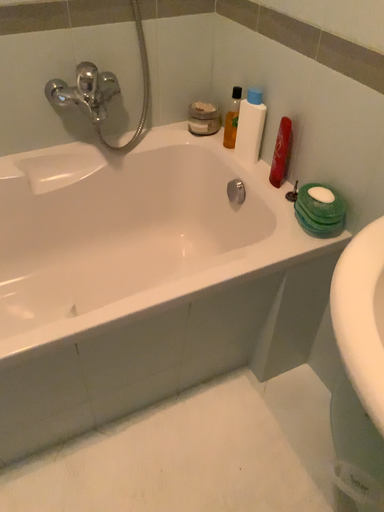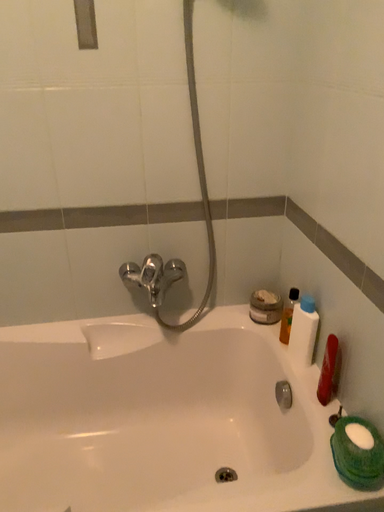
Question: How did the camera likely rotate when shooting the video?

Choices:
 (A) rotated right
 (B) rotated left

Answer: (B)